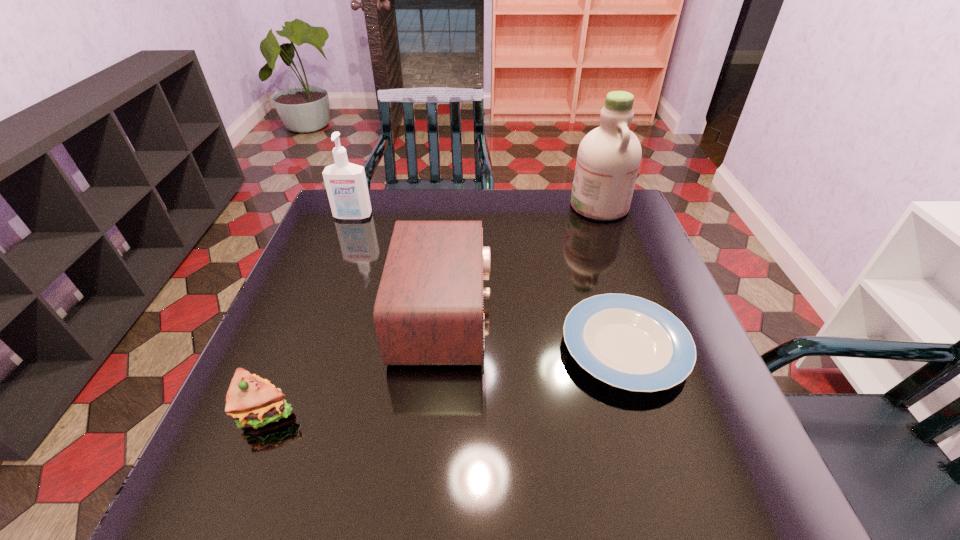
The height and width of the screenshot is (540, 960). I want to click on vacant space in between the plate and the second tallest object, so click(x=489, y=282).

Image resolution: width=960 pixels, height=540 pixels. In order to click on vacant space that is in between the radio receiver and the plate in this screenshot , I will do `click(534, 332)`.

In order to click on free space between the sandwich and the second tallest object in this screenshot , I will do `click(309, 314)`.

Find the location of a particular element. free space between the plate and the third object from left to right is located at coordinates (534, 332).

Find the location of a particular element. empty location between the fourth tallest object and the left cleansing agent is located at coordinates (309, 314).

What are the coordinates of `vacant area that lies between the right cleansing agent and the third object from right to left` in the screenshot? It's located at (521, 261).

Choose which object is the second nearest neighbor to the sandwich. Please provide its 2D coordinates. Your answer should be formatted as a tuple, i.e. [(x, y)], where the tuple contains the x and y coordinates of a point satisfying the conditions above.

[(626, 341)]

Where is `object that is the closest to the shortest object`? object that is the closest to the shortest object is located at coordinates (428, 310).

The width and height of the screenshot is (960, 540). Identify the location of free spot that satisfies the following two spatial constraints: 1. on the front panel of the third tallest object; 2. on the back side of the shortest object. (441, 347).

Locate an element on the screen. Image resolution: width=960 pixels, height=540 pixels. free region that satisfies the following two spatial constraints: 1. on the front label of the shorter cleansing agent; 2. on the right side of the plate is located at coordinates (301, 347).